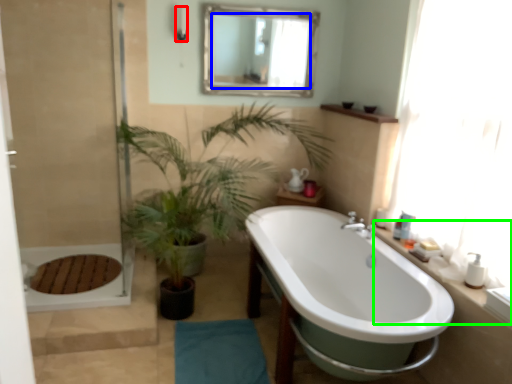
Question: Considering the real-world distances, which object is farthest from shower (highlighted by a red box)? mirror (highlighted by a blue box) or counter top (highlighted by a green box)?

Choices:
 (A) mirror
 (B) counter top

Answer: (B)